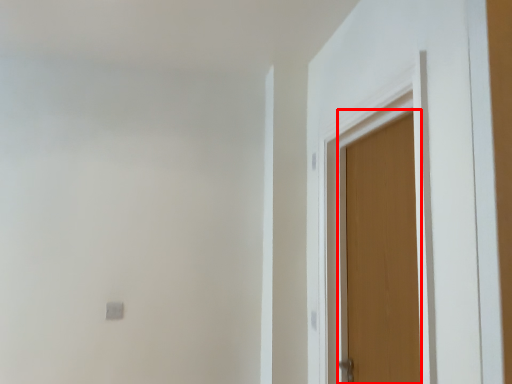
Question: From the image, what is the correct spatial relationship of door (annotated by the red box) in relation to door?

Choices:
 (A) right
 (B) left

Answer: (A)